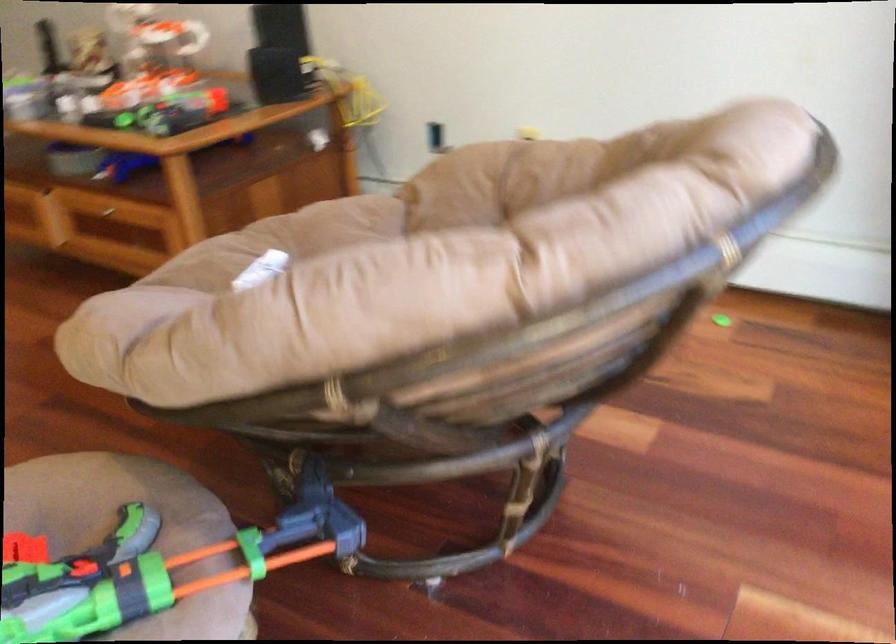
Identify the location of drawer handle. This screenshot has height=644, width=896. (107, 213).